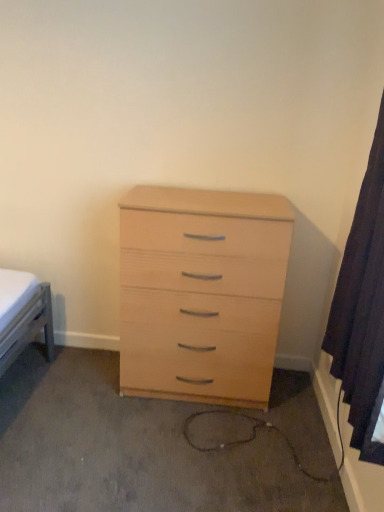
You are a GUI agent. You are given a task and a screenshot of the screen. Output one action in this format:
    pyautogui.click(x=<x>, y=<y>)
    Task: Click on the free space underneath dark fabric curtain at right (from a real-world perspective)
    Image resolution: width=384 pixels, height=512 pixels.
    Given the screenshot: What is the action you would take?
    pyautogui.click(x=319, y=483)